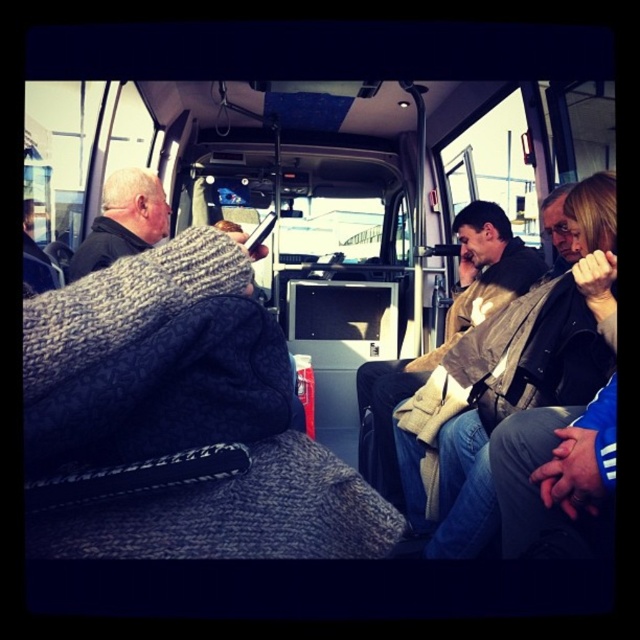
Who is lower down, brown leather jacket at center or dark gray knit sweater at left?

Positioned lower is brown leather jacket at center.

The width and height of the screenshot is (640, 640). I want to click on brown leather jacket at center, so pos(444,332).

Which is behind, point (72, 456) or point (138, 237)?

Point (138, 237)

Is point (51, 554) more distant than point (147, 228)?

No, it is not.

Image resolution: width=640 pixels, height=640 pixels. Find the location of `matte black jacket at upper left`. matte black jacket at upper left is located at coordinates (161, 392).

Is leather jacket at right in front of black plastic phone at center?

No, it is behind black plastic phone at center.

Based on the photo, which is more to the left, leather jacket at right or black plastic phone at center?

black plastic phone at center is more to the left.

Where is `leather jacket at right`? The height and width of the screenshot is (640, 640). leather jacket at right is located at coordinates (502, 401).